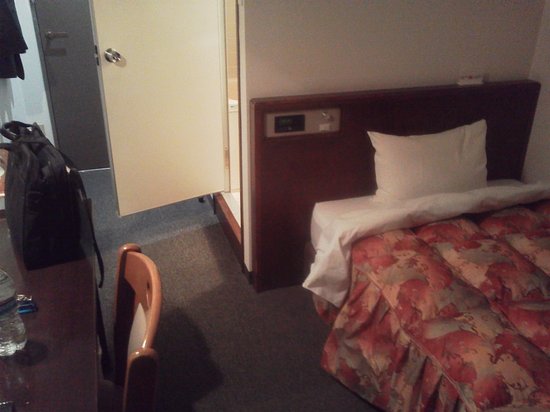
Where is `chair`? chair is located at coordinates (146, 281).